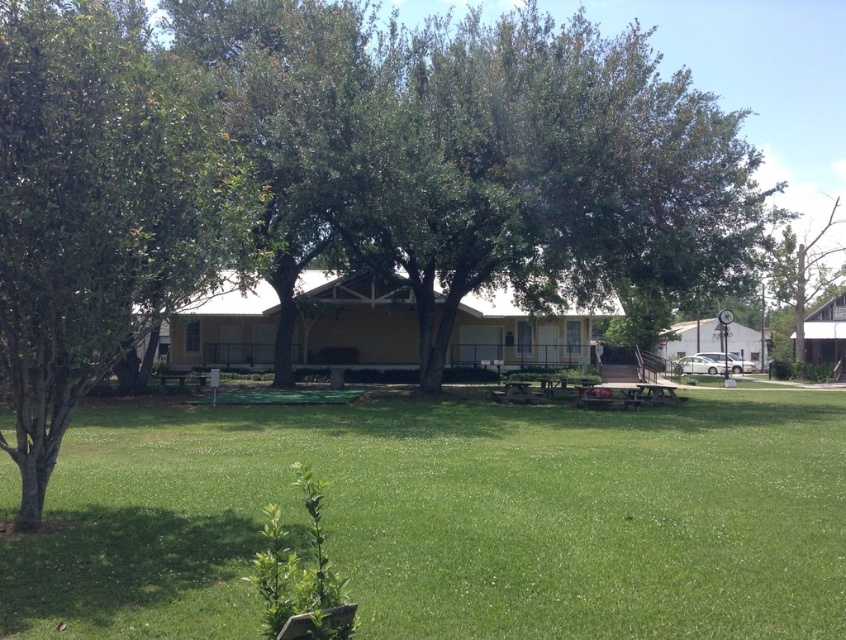
Is point (144, 452) behind point (114, 241)?

That is True.

Can you confirm if green grass at center is wider than green leafy tree at left?

Correct, the width of green grass at center exceeds that of green leafy tree at left.

Who is more distant from viewer, (608, 529) or (114, 10)?

Positioned behind is point (114, 10).

The width and height of the screenshot is (846, 640). What are the coordinates of `green grass at center` in the screenshot? It's located at (449, 518).